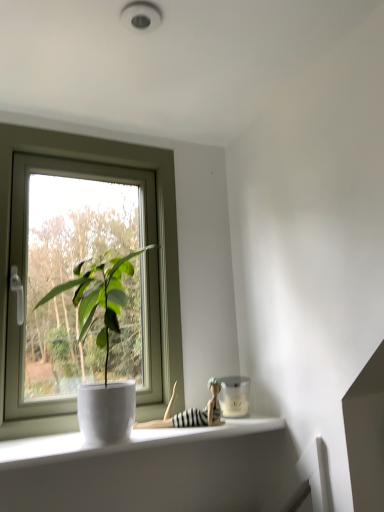
Identify the location of white glossy window sill at lower left. This screenshot has width=384, height=512. (126, 442).

I want to click on white plastic window at left, so click(x=159, y=251).

In the scene shown: Between white plastic window at left and white glossy pot at window, which one has smaller size?

white plastic window at left.

Considering the relative sizes of white plastic window at left and white glossy pot at window in the image provided, is white plastic window at left thinner than white glossy pot at window?

Yes.

Consider the image. Is white plastic window at left not close to white glossy pot at window?

No, there isn't a large distance between white plastic window at left and white glossy pot at window.

Is white glossy pot at window facing towards white plastic window at left?

No, white glossy pot at window is not turned towards white plastic window at left.

From the image's perspective, is white glossy pot at window located beneath white plastic window at left?

Yes, from the image's perspective, white glossy pot at window is beneath white plastic window at left.

Who is shorter, white glossy pot at window or white plastic window at left?

Standing shorter between the two is white glossy pot at window.

Find the location of a particular element. This screenshot has height=512, width=384. window above the striped fabric doll at lower center (from the image's perspective) is located at coordinates click(159, 251).

Considering the sizes of objects striped fabric doll at lower center and white plastic window at left in the image provided, who is taller, striped fabric doll at lower center or white plastic window at left?

Standing taller between the two is white plastic window at left.

Is striped fabric doll at lower center bigger or smaller than white plastic window at left?

striped fabric doll at lower center is smaller than white plastic window at left.

From the image's perspective, between white glossy window sill at lower left and white glossy pot at window, who is located below?

white glossy window sill at lower left.

Is white glossy window sill at lower left not close to white glossy pot at window?

That's not correct — white glossy window sill at lower left is a little close to white glossy pot at window.

Between white glossy window sill at lower left and white glossy pot at window, which one has larger width?

white glossy pot at window is wider.

You are a GUI agent. You are given a task and a screenshot of the screen. Output one action in this format:
    pyautogui.click(x=<x>, y=<y>)
    Task: Click on the houseplant located in front of the white glossy window sill at lower left
    This screenshot has height=512, width=384.
    Given the screenshot: What is the action you would take?
    pyautogui.click(x=102, y=348)

From a real-world perspective, is white glossy pot at window beneath white glossy window sill at lower left?

No, from a real-world perspective, white glossy pot at window is not under white glossy window sill at lower left.

Can you tell me how much white glossy pot at window and white glossy window sill at lower left differ in facing direction?

They differ by 0.526 degrees in their facing directions.

Where is `houseplant above the white glossy window sill at lower left (from a real-world perspective)`? houseplant above the white glossy window sill at lower left (from a real-world perspective) is located at coordinates click(x=102, y=348).

Considering the sizes of objects white glossy pot at window and white glossy window sill at lower left in the image provided, who is taller, white glossy pot at window or white glossy window sill at lower left?

With more height is white glossy pot at window.

Does white glossy window sill at lower left contain striped fabric doll at lower center?

Actually, striped fabric doll at lower center is outside white glossy window sill at lower left.

From the image's perspective, would you say white glossy window sill at lower left is shown under striped fabric doll at lower center?

Yes, from the image's perspective, white glossy window sill at lower left is beneath striped fabric doll at lower center.

Considering the sizes of objects white glossy window sill at lower left and striped fabric doll at lower center in the image provided, who is smaller, white glossy window sill at lower left or striped fabric doll at lower center?

With smaller size is striped fabric doll at lower center.

Which of these two, white glossy window sill at lower left or striped fabric doll at lower center, is thinner?

With smaller width is striped fabric doll at lower center.

Would you say striped fabric doll at lower center is a long distance from white glossy window sill at lower left?

Actually, striped fabric doll at lower center and white glossy window sill at lower left are a little close together.

Which of these two, striped fabric doll at lower center or white glossy window sill at lower left, is thinner?

Thinner between the two is striped fabric doll at lower center.

Is point (214, 423) closer to viewer compared to point (195, 431)?

No, it is behind (195, 431).

This screenshot has width=384, height=512. Find the location of `houseplant below the white plastic window at left (from the image's perspective)`. houseplant below the white plastic window at left (from the image's perspective) is located at coordinates (102, 348).

This screenshot has width=384, height=512. Find the location of `window that appears behind the white glossy pot at window`. window that appears behind the white glossy pot at window is located at coordinates (159, 251).

Considering their positions, is white glossy window sill at lower left positioned further to striped fabric doll at lower center than white plastic window at left?

white plastic window at left.

Looking at the image, which one is located closer to white plastic window at left, striped fabric doll at lower center or white glossy window sill at lower left?

white glossy window sill at lower left is positioned closer to the anchor white plastic window at left.

Based on their spatial positions, is white glossy window sill at lower left or white glossy pot at window further from white plastic window at left?

Among the two, white glossy window sill at lower left is located further to white plastic window at left.

Looking at this image, which object lies nearer to the anchor point striped fabric doll at lower center, white glossy window sill at lower left or white glossy pot at window?

white glossy window sill at lower left lies closer to striped fabric doll at lower center than the other object.

When comparing their distances from striped fabric doll at lower center, does white glossy pot at window or white glossy window sill at lower left seem further?

Based on the image, white glossy pot at window appears to be further to striped fabric doll at lower center.

Consider the image. Considering their positions, is striped fabric doll at lower center positioned closer to white plastic window at left than white glossy pot at window?

The object closer to white plastic window at left is white glossy pot at window.

Based on their spatial positions, is white plastic window at left or white glossy window sill at lower left further from striped fabric doll at lower center?

Among the two, white plastic window at left is located further to striped fabric doll at lower center.

Which object lies nearer to the anchor point white glossy pot at window, white glossy window sill at lower left or striped fabric doll at lower center?

Among the two, white glossy window sill at lower left is located nearer to white glossy pot at window.

What are the coordinates of `houseplant that lies between white plastic window at left and striped fabric doll at lower center from top to bottom` in the screenshot? It's located at (102, 348).

Where is `window sill between white glossy pot at window and striped fabric doll at lower center in the front-back direction`? Image resolution: width=384 pixels, height=512 pixels. window sill between white glossy pot at window and striped fabric doll at lower center in the front-back direction is located at coordinates (126, 442).

Find the location of a particular element. toy between white plastic window at left and white glossy window sill at lower left vertically is located at coordinates [189, 413].

Find the location of a particular element. houseplant between white plastic window at left and white glossy window sill at lower left from top to bottom is located at coordinates (102, 348).